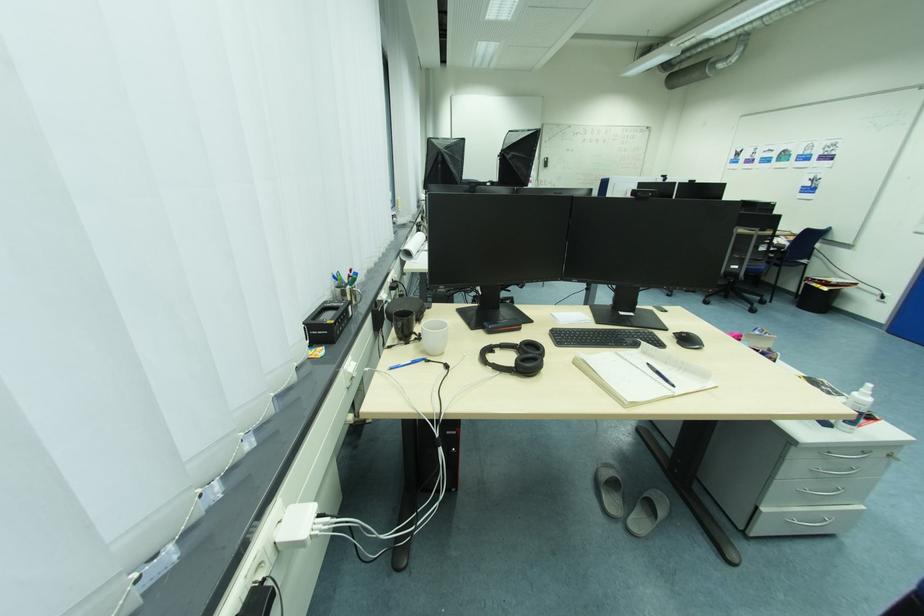
Where would you grasp the black computer mouse? Please return your answer as a coordinate pair (x, y).

(687, 339)